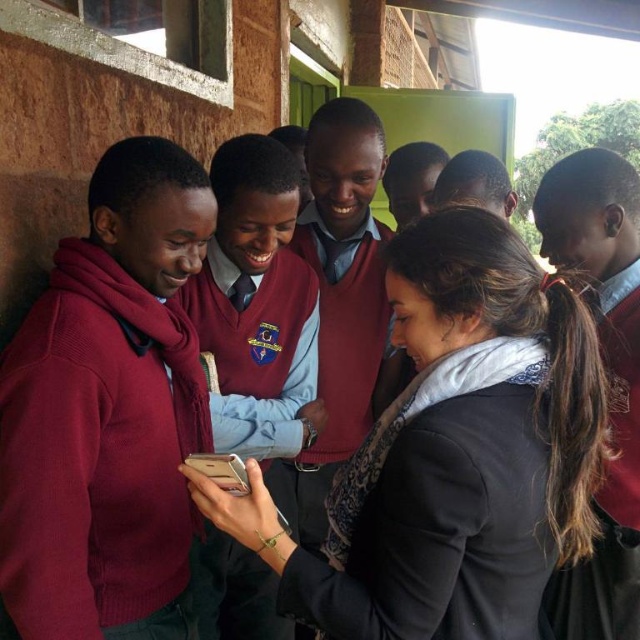
Question: Which point is farther to the camera?

Choices:
 (A) (332, 513)
 (B) (250, 365)
 (C) (102, 516)
 (D) (464, 349)

Answer: (B)

Question: Among these objects, which one is farthest from the camera?

Choices:
 (A) maroon sweater at center
 (B) black matte jacket at center

Answer: (A)

Question: Is black matte jacket at center to the right of maroon sweater at center from the viewer's perspective?

Choices:
 (A) yes
 (B) no

Answer: (A)

Question: Is black matte jacket at center bigger than black matte sweater at center?

Choices:
 (A) no
 (B) yes

Answer: (B)

Question: Is maroon sweater at left smaller than black matte sweater at center?

Choices:
 (A) no
 (B) yes

Answer: (A)

Question: Which is nearer to the black matte jacket at center?

Choices:
 (A) black matte sweater at center
 (B) maroon sweater at center

Answer: (A)